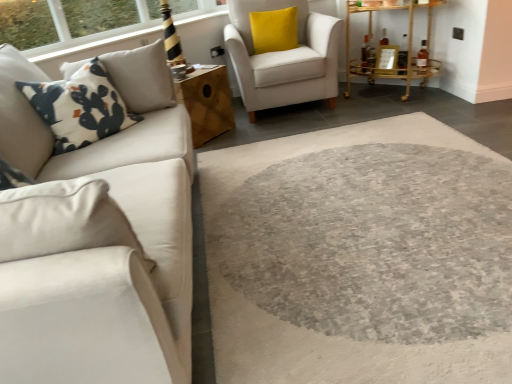
Question: From a real-world perspective, is satin white couch at left positioned above or below yellow velvet pillow at upper right?

Choices:
 (A) below
 (B) above

Answer: (B)

Question: Is satin white couch at left wider or thinner than yellow velvet pillow at upper right?

Choices:
 (A) thin
 (B) wide

Answer: (B)

Question: Estimate the real-world distances between objects in this image. Which object is farther from the wooden cube at center, the second table positioned from the right?

Choices:
 (A) satin white couch at left
 (B) soft white fabric armchair at center
 (C) white printed fabric pillow at left
 (D) gold metallic bar cart at upper right, which ranks as the 1th table in right-to-left order
 (E) yellow velvet pillow at upper right

Answer: (D)

Question: Estimate the real-world distances between objects in this image. Which object is closer to the satin white couch at left?

Choices:
 (A) yellow velvet pillow at upper right
 (B) wooden cube at center, the 1th table in the left-to-right sequence
 (C) soft white fabric armchair at center
 (D) gold metallic bar cart at upper right, positioned as the 2th table in left-to-right order
 (E) white printed fabric pillow at left

Answer: (E)